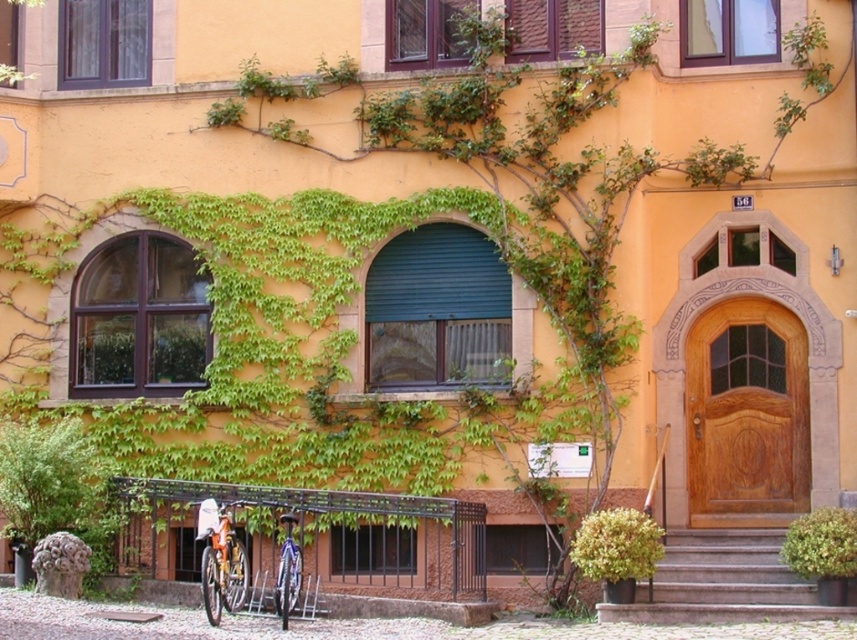
You are standing in front of the building and want to take a photo of the point at coordinates point [571,48]. If your camera can focus on objects up to 25 meters away, will you be able to capture the point clearly?

The distance of point [571,48] from the camera is 22.38 meters, which is within the camera focus range of 25 meters. Therefore, you can capture the point clearly.

You are standing at point A located at point (103, 6). You want to walk to point B, which is 80.44 feet away. Is there any obstacle between you and point B in the scene?

The distance between point A at point (103, 6) and point B is 80.44 feet. The scene description mentions a building facade with ivy, windows, and a wooden door, but does not specify any obstacles along the path between the two points. Therefore, there may be no visible obstacles blocking the path between point A at point (103, 6) and point B.

You are standing in front of the building and notice two points marked on the facade. The first point is at coordinates point (589, 44) and the second is at point (441, 32). Which point is closer to you?

Point (589, 44) is in front of point (441, 32), so it is closer to you.